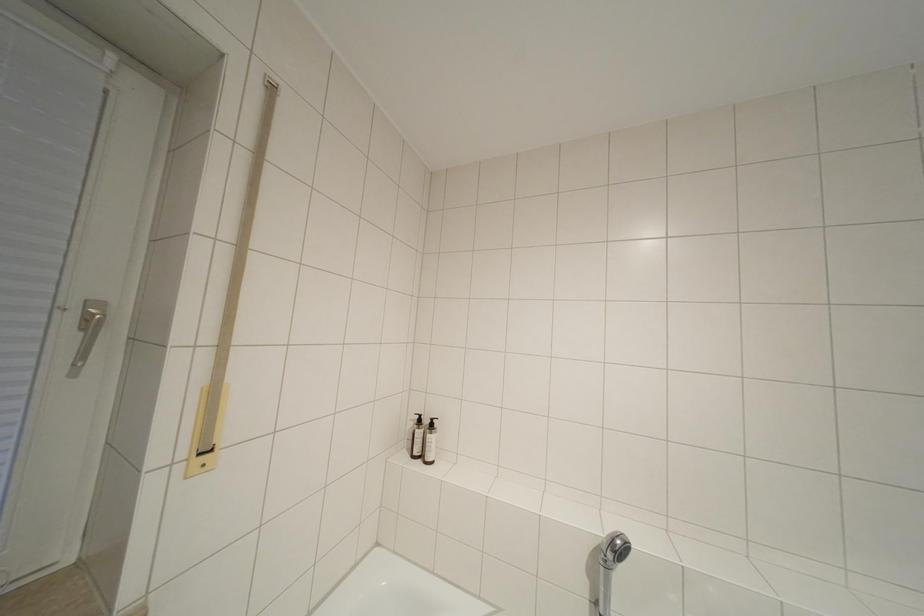
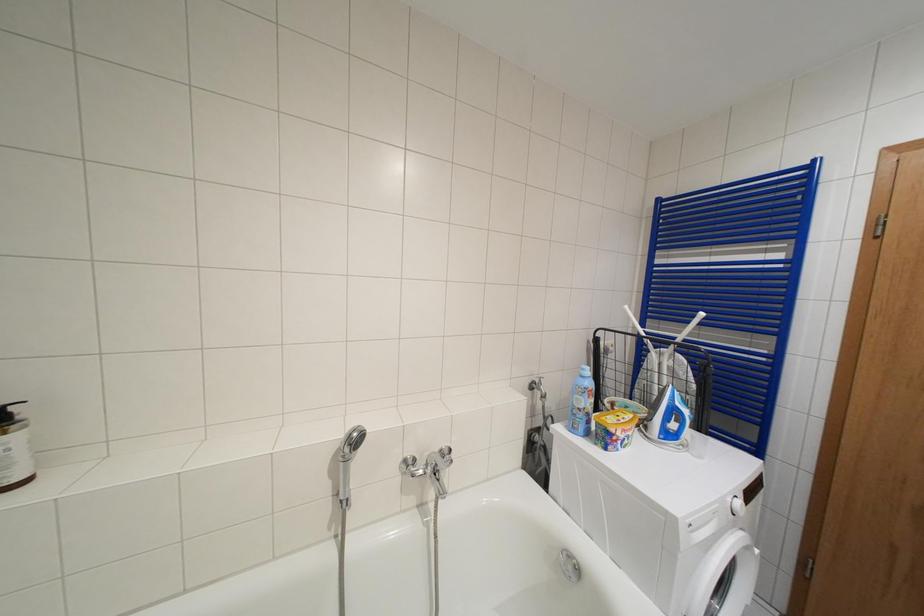
Question: Based on the continuous images, in which direction is the camera rotating? Reply with the corresponding letter.

Choices:
 (A) Left
 (B) Right
 (C) Up
 (D) Down

Answer: (B)